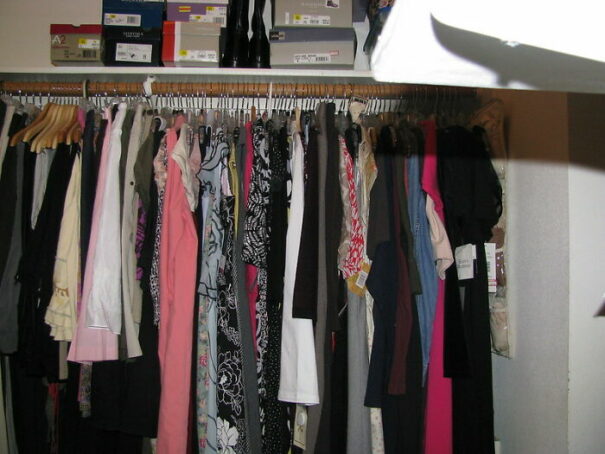
The height and width of the screenshot is (454, 605). Find the location of `the top shelf`. the top shelf is located at coordinates [x=249, y=71].